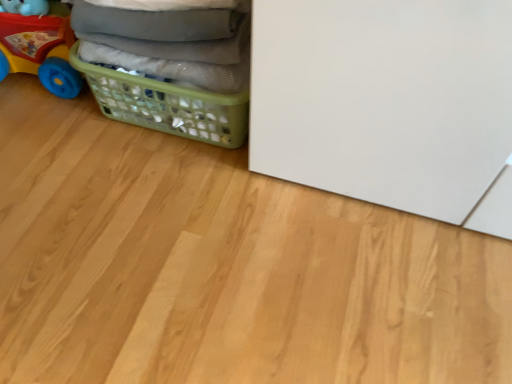
Question: In terms of height, does plastic toy car at left look taller or shorter compared to green plastic laundry basket at lower left?

Choices:
 (A) short
 (B) tall

Answer: (B)

Question: Is point (37, 1) closer or farther from the camera than point (238, 132)?

Choices:
 (A) closer
 (B) farther

Answer: (A)

Question: Looking at their shapes, would you say plastic toy car at left is wider or thinner than green plastic laundry basket at lower left?

Choices:
 (A) wide
 (B) thin

Answer: (B)

Question: Is point 134,120 positioned closer to the camera than point 41,18?

Choices:
 (A) farther
 (B) closer

Answer: (A)

Question: In the image, is green plastic laundry basket at lower left positioned in front of or behind plastic toy car at left?

Choices:
 (A) front
 (B) behind

Answer: (A)

Question: Considering the positions of green plastic laundry basket at lower left and plastic toy car at left in the image, is green plastic laundry basket at lower left wider or thinner than plastic toy car at left?

Choices:
 (A) wide
 (B) thin

Answer: (A)

Question: From their relative heights in the image, would you say green plastic laundry basket at lower left is taller or shorter than plastic toy car at left?

Choices:
 (A) short
 (B) tall

Answer: (A)